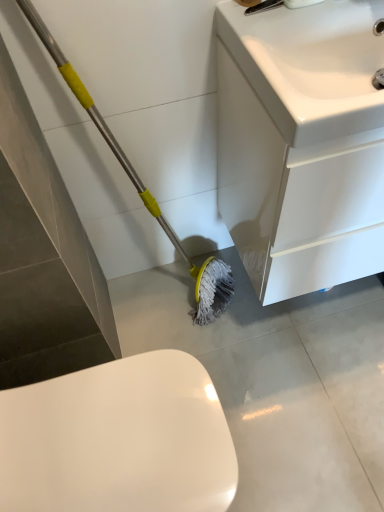
Question: Is white glossy toilet at lower left wider or thinner than white glossy cabinet at lower right?

Choices:
 (A) thin
 (B) wide

Answer: (B)

Question: Considering their positions, is white glossy toilet at lower left located in front of or behind white glossy cabinet at lower right?

Choices:
 (A) front
 (B) behind

Answer: (A)

Question: Which object is the closest to the white glossy toilet at lower left?

Choices:
 (A) white glossy sink at upper right
 (B) white glossy cabinet at lower right

Answer: (B)

Question: Based on their relative distances, which object is farther from the white glossy cabinet at lower right?

Choices:
 (A) white glossy sink at upper right
 (B) white glossy toilet at lower left

Answer: (B)